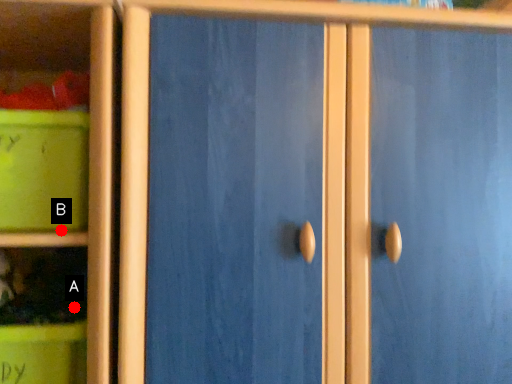
Question: Two points are circled on the image, labeled by A and B beside each circle. Which point is farther from the camera taking this photo?

Choices:
 (A) A is further
 (B) B is further

Answer: (A)